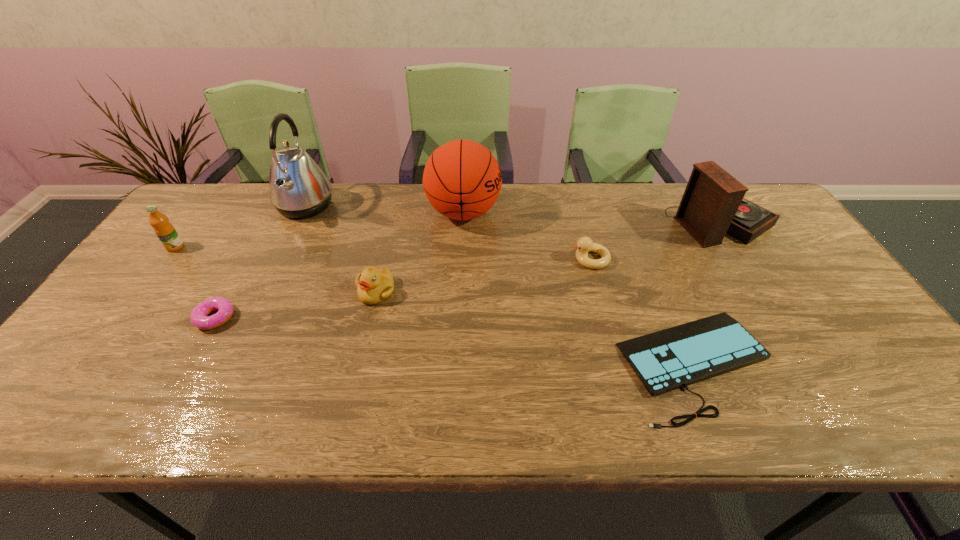
Locate an element on the screen. vacant space at the right edge of the desktop is located at coordinates (780, 263).

Identify the location of vacant area at the far left corner. [x=219, y=197].

I want to click on free space between the basketball and the doughnut, so click(x=340, y=265).

Identify the location of free space between the shortest object and the orange juice. Image resolution: width=960 pixels, height=540 pixels. (436, 306).

What are the coordinates of `blank region between the second shortest object and the right duckling` in the screenshot? It's located at (402, 288).

This screenshot has width=960, height=540. I want to click on free space between the seventh shortest object and the orange juice, so click(x=320, y=230).

This screenshot has height=540, width=960. What are the coordinates of `unoccupied position between the right duckling and the second shortest object` in the screenshot? It's located at (402, 288).

Where is `free space between the nearer duckling and the shortest object`? This screenshot has width=960, height=540. free space between the nearer duckling and the shortest object is located at coordinates (536, 328).

At what (x,y) coordinates should I click in order to perform the action: click on free space between the leftmost object and the kettle. Please return your answer as a coordinate pair (x, y). The image size is (960, 540). Looking at the image, I should click on (240, 227).

Where is `vacant space in between the farther duckling and the orange juice`? vacant space in between the farther duckling and the orange juice is located at coordinates (383, 253).